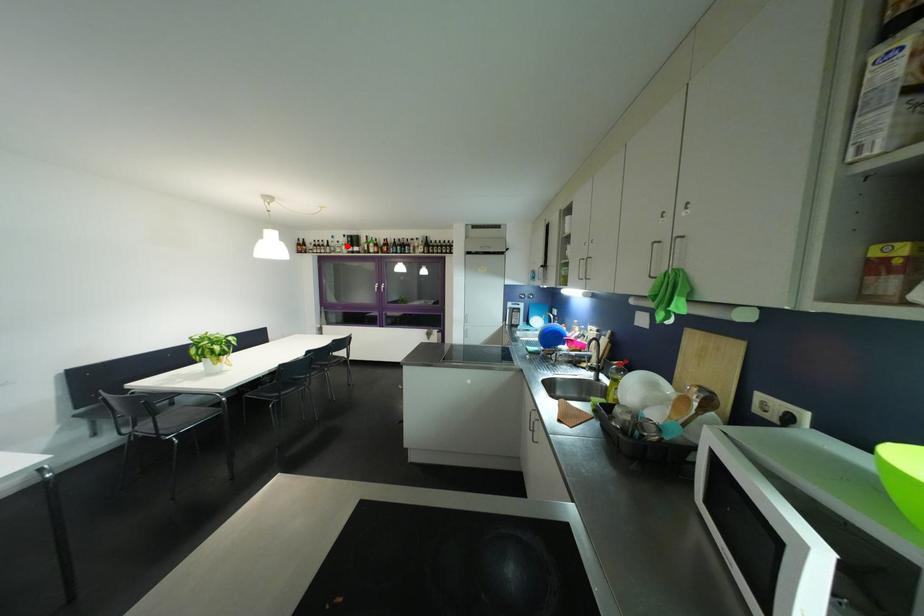
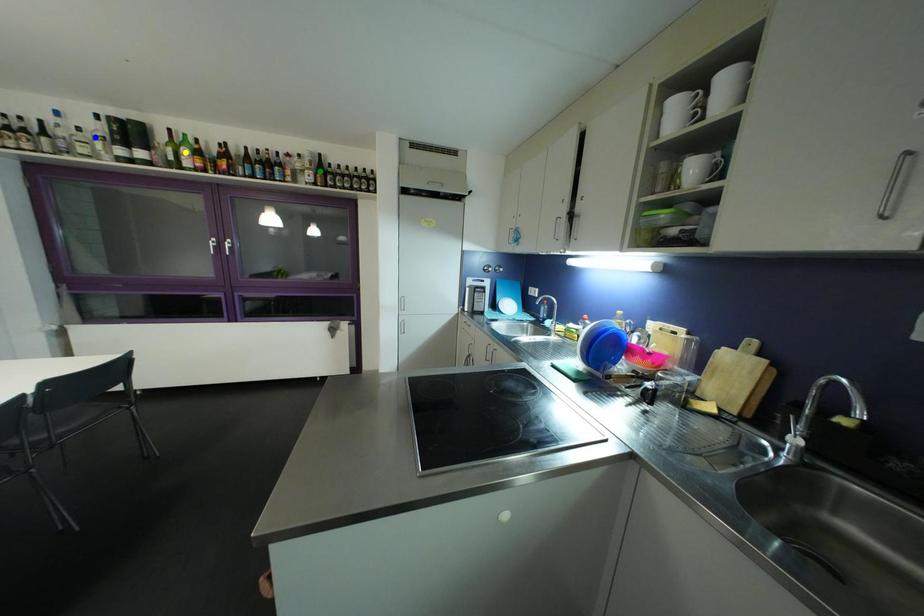
Question: I am providing you with two images of the same scene from different viewpoints. A red point is marked on the first image. You are given multiple points on the second image. Which mark in image 2 goes with the point in image 1?

Choices:
 (A) blue point
 (B) green point
 (C) yellow point

Answer: (A)